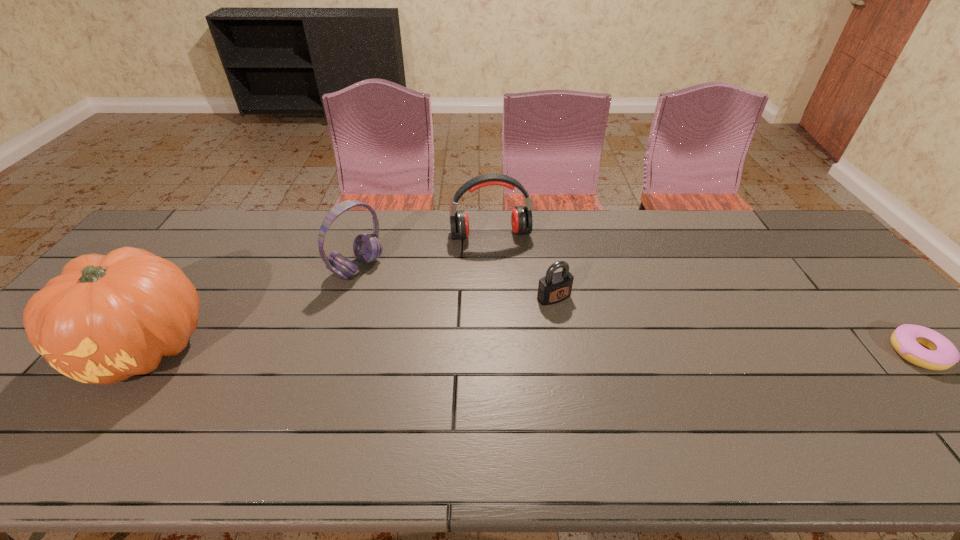
Where is `free space on the desktop that is between the pumpkin and the shortest object and is positioned on the front of the fourth tallest object near the keyhole`? free space on the desktop that is between the pumpkin and the shortest object and is positioned on the front of the fourth tallest object near the keyhole is located at coordinates (598, 350).

The image size is (960, 540). I want to click on free space on the desktop that is between the leftmost object and the shortest object and is positioned on the ear cups of the farthest object, so click(519, 349).

The width and height of the screenshot is (960, 540). Identify the location of free space on the desktop that is between the pumpkin and the rightmost object and is positioned on the headband and ear cups of the second farthest object. (499, 349).